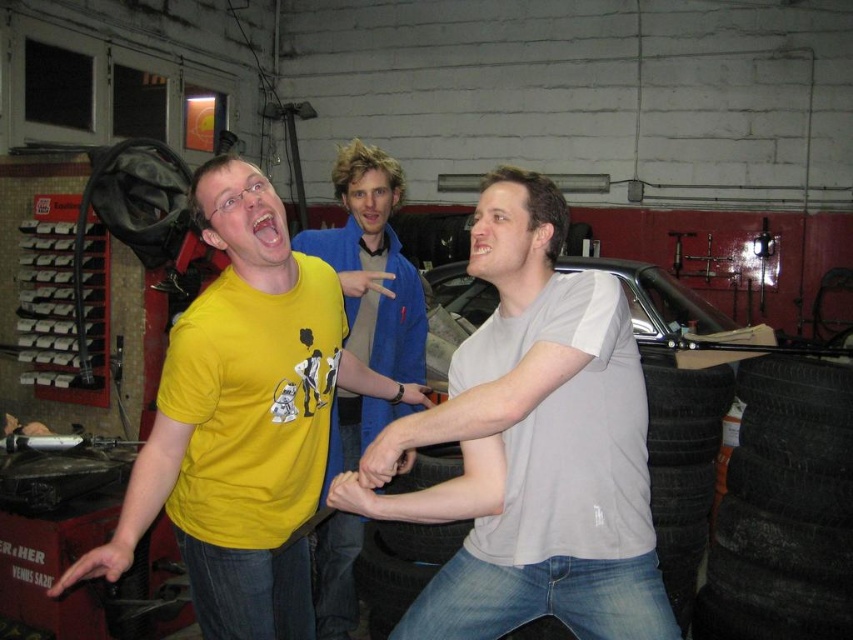
Question: Which point is closer to the camera?

Choices:
 (A) gray matte t-shirt at center
 (B) black rubber tire at lower center
 (C) yellow t-shirt at left
 (D) yellow matte t-shirt at left

Answer: (A)

Question: Does gray matte t-shirt at center appear under black rubber tire at lower center?

Choices:
 (A) yes
 (B) no

Answer: (B)

Question: From the image, what is the correct spatial relationship of yellow t-shirt at left in relation to black rubber tire at lower center?

Choices:
 (A) left
 (B) right

Answer: (A)

Question: Which point is farther to the camera?

Choices:
 (A) gray matte t-shirt at center
 (B) yellow t-shirt at left
 (C) yellow matte t-shirt at left

Answer: (B)

Question: Among these objects, which one is farthest from the camera?

Choices:
 (A) yellow matte t-shirt at left
 (B) gray matte t-shirt at center
 (C) black rubber tire at lower center
 (D) yellow t-shirt at left

Answer: (C)

Question: Is gray matte t-shirt at center to the right of yellow matte t-shirt at left from the viewer's perspective?

Choices:
 (A) yes
 (B) no

Answer: (A)